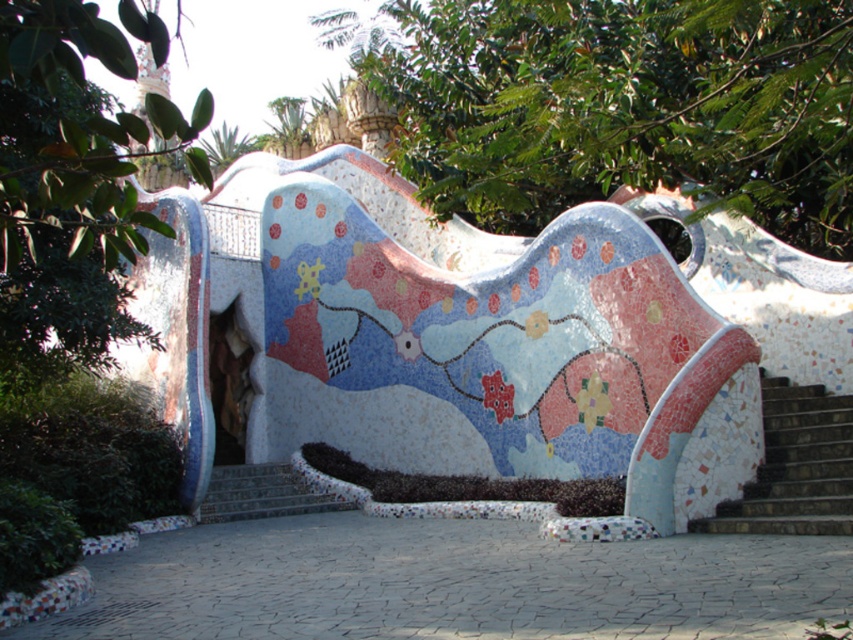
You are a visitor at the park and want to sit on the mosaic bench at center. From where you are standing at the dark brown stone stairs at right, which direction should you move to reach the bench?

The mosaic bench at center is positioned on the left side of dark brown stone stairs at right, so you should move to the left to reach the bench.

You are planning to place a large rectangular picnic blanket on the mosaic bench at center and dark brown stone stairs at right. Which surface can accommodate the blanket without folding it, considering their widths?

The mosaic bench at center can accommodate the large rectangular picnic blanket without folding it because its width surpasses that of the dark brown stone stairs at right.